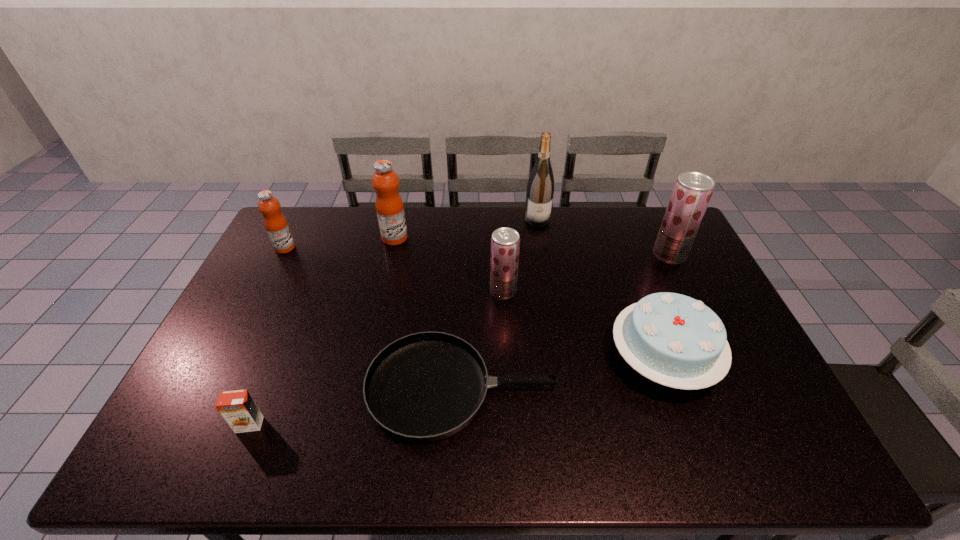
This screenshot has height=540, width=960. In order to click on object that is at the far left corner in this screenshot , I will do `click(276, 225)`.

The image size is (960, 540). In order to click on object present at the far right corner in this screenshot , I will do `click(692, 191)`.

Identify the location of vacant space at the far edge of the desktop. This screenshot has width=960, height=540. (437, 217).

This screenshot has width=960, height=540. Identify the location of vacant space at the near edge. coord(269,451).

In the image, there is a desktop. Where is `free region at the left edge`? free region at the left edge is located at coordinates (307, 260).

This screenshot has width=960, height=540. I want to click on vacant space at the far right corner of the desktop, so click(x=650, y=209).

In order to click on unoccupied position between the bigger orange fruit juice and the wine bottle in this screenshot , I will do `click(466, 228)`.

Find the location of a particular element. The width and height of the screenshot is (960, 540). empty location between the brown wine bottle and the blue birthday cake is located at coordinates (600, 289).

Identify the location of vacant area that lies between the smaller orange fruit juice and the blue birthday cake. This screenshot has height=540, width=960. (474, 303).

Locate an element on the screen. The width and height of the screenshot is (960, 540). vacant area between the orange orange juice and the brown wine bottle is located at coordinates (394, 322).